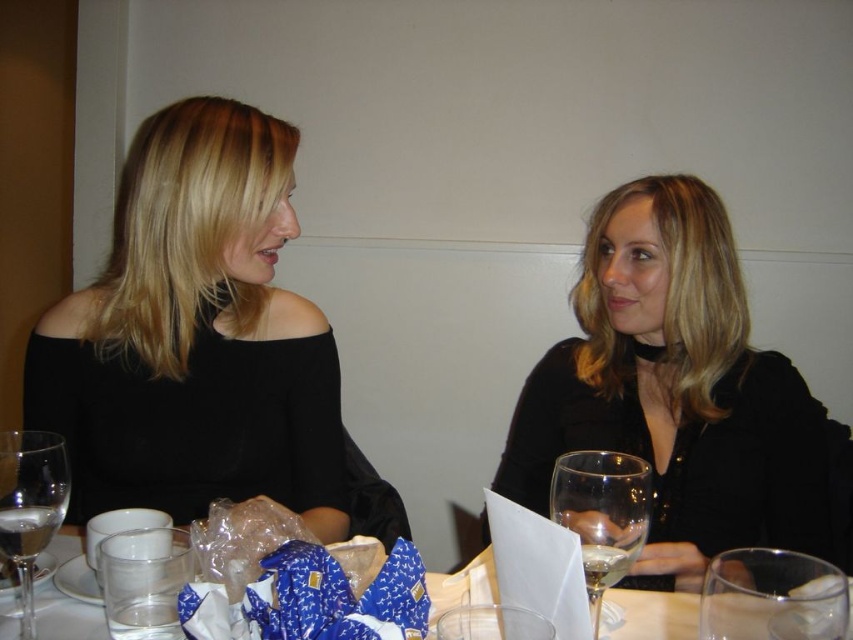
You are a waiter in a restaurant and need to place a 18 cm long decorative ribbon between the clear glass wine glass at center and the clear glass water at lower center. Can you fit the ribbon between them without overlapping either glass?

The clear glass wine glass at center is 17.98 centimeters from clear glass water at lower center. Since the distance between them is slightly less than 18 cm, the ribbon cannot be placed between them without overlapping the glasses.

You are a photographer setting up a shoot at a restaurant table. You have a black matte dress at center and a clear glass wine glass at center on the table. If you want to ensure both items are visible in your photo, which object should you focus on first to avoid blurring due to size differences?

The black matte dress at center is bigger than the clear glass wine glass at center, so you should focus on the larger object first to ensure proper focus on both items.

You are a photographer taking a picture of the black matte dress at center and the clear glass wine glass at center. Which object will appear larger in the photo?

The black matte dress at center will appear larger in the photo because it is closer to the viewer than the clear glass wine glass at center.